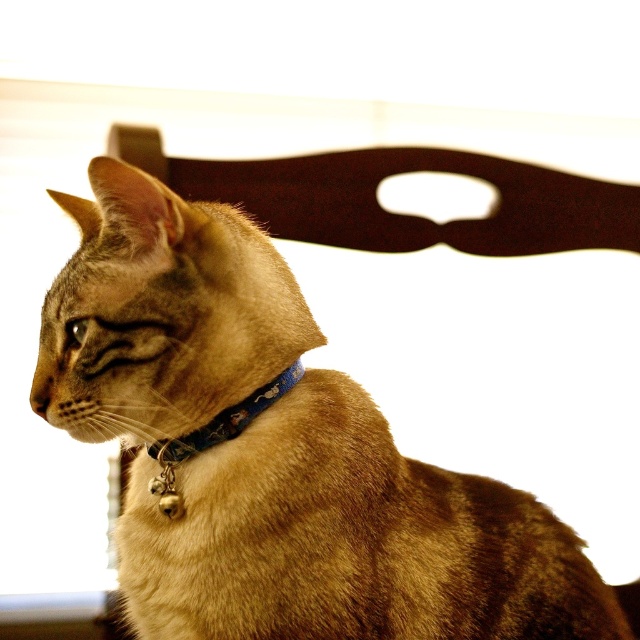
Question: Does brown fur cat at center lie behind blue fabric neckband at center?

Choices:
 (A) no
 (B) yes

Answer: (A)

Question: Does brown fur cat at center have a greater width compared to blue fabric neckband at center?

Choices:
 (A) no
 (B) yes

Answer: (B)

Question: Which object is closer to the camera taking this photo?

Choices:
 (A) blue fabric neckband at center
 (B) brown fur cat at center

Answer: (B)

Question: Is brown fur cat at center closer to the viewer compared to blue fabric neckband at center?

Choices:
 (A) no
 (B) yes

Answer: (B)

Question: Which object appears farthest from the camera in this image?

Choices:
 (A) brown fur cat at center
 (B) blue fabric neckband at center

Answer: (B)